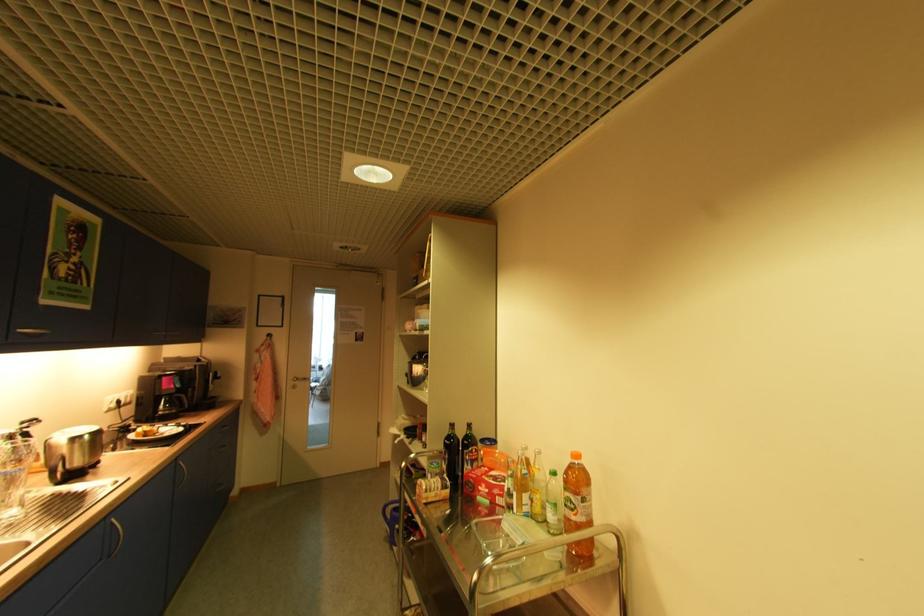
Find the location of a particular element. This screenshot has height=616, width=924. green glass bottle is located at coordinates (451, 456).